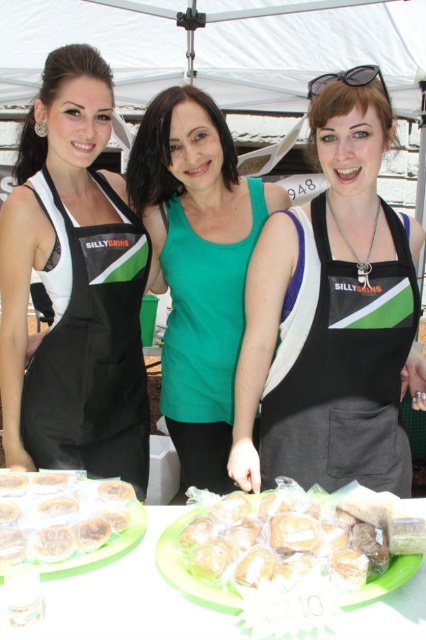
Does black fabric apron at center come behind translucent plastic muffins at lower left?

Yes.

Does point (334, 465) come behind point (16, 476)?

Yes, point (334, 465) is farther from viewer.

The image size is (426, 640). I want to click on black fabric apron at center, so click(340, 368).

Can you confirm if translucent plastic muffins at lower left is bigger than black plastic sunglasses at upper center?

No.

Looking at this image, does translucent plastic muffins at lower left have a lesser height compared to black plastic sunglasses at upper center?

Yes, translucent plastic muffins at lower left is shorter than black plastic sunglasses at upper center.

This screenshot has height=640, width=426. I want to click on translucent plastic muffins at lower left, so click(65, 518).

Does green plastic plates at center have a lesser width compared to golden brown pastry at center?

Incorrect, green plastic plates at center's width is not less than golden brown pastry at center's.

Does point (138, 556) come in front of point (183, 588)?

No, it is behind (183, 588).

I want to click on green plastic plates at center, so click(124, 600).